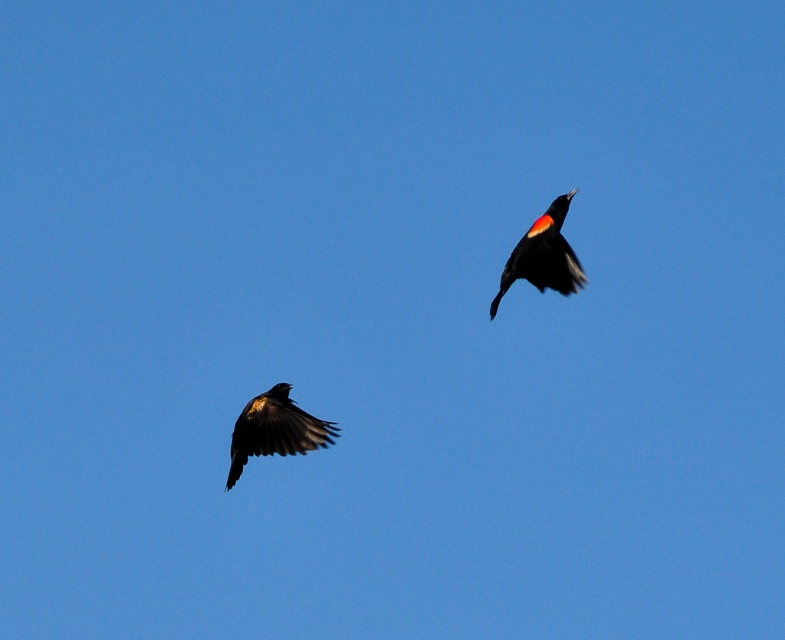
Question: Does shiny black bird at lower left appear over shiny black bird at upper right?

Choices:
 (A) no
 (B) yes

Answer: (A)

Question: Is shiny black bird at lower left above shiny black bird at upper right?

Choices:
 (A) no
 (B) yes

Answer: (A)

Question: Does shiny black bird at lower left have a larger size compared to shiny black bird at upper right?

Choices:
 (A) yes
 (B) no

Answer: (A)

Question: Which point is closer to the camera?

Choices:
 (A) click(x=298, y=424)
 (B) click(x=543, y=250)

Answer: (A)

Question: Which of the following is the farthest from the observer?

Choices:
 (A) (499, 282)
 (B) (232, 458)

Answer: (B)